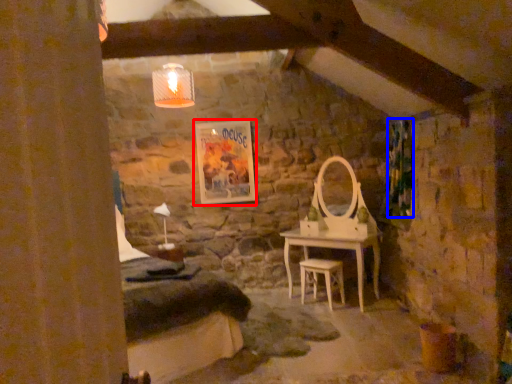
Question: Which object is closer to the camera taking this photo, picture frame (highlighted by a red box) or curtain (highlighted by a blue box)?

Choices:
 (A) picture frame
 (B) curtain

Answer: (B)